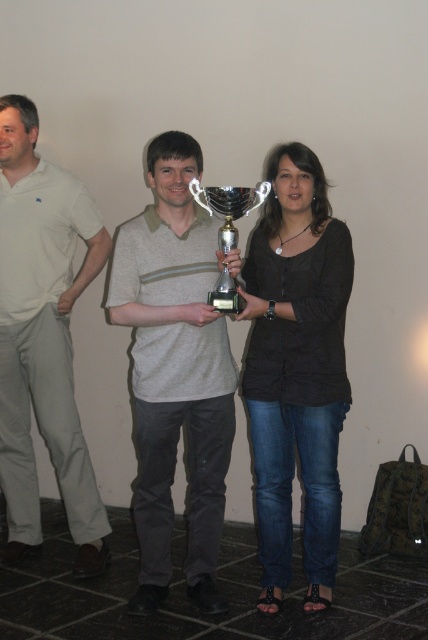
Can you confirm if black matte shirt at center is taller than white cotton shirt at left?

Incorrect, black matte shirt at center's height is not larger of white cotton shirt at left's.

Is point (267, 204) closer to camera compared to point (92, 563)?

Yes, it is.

The height and width of the screenshot is (640, 428). What are the coordinates of `black matte shirt at center` in the screenshot? It's located at (297, 371).

Who is positioned more to the right, gray striped polo shirt at center or white cotton shirt at left?

gray striped polo shirt at center

Looking at this image, is gray striped polo shirt at center bigger than white cotton shirt at left?

Correct, gray striped polo shirt at center is larger in size than white cotton shirt at left.

Does point (222, 440) lie in front of point (24, 408)?

Yes, it is in front of point (24, 408).

The width and height of the screenshot is (428, 640). In order to click on gray striped polo shirt at center in this screenshot , I will do `click(175, 371)`.

Which of these two, white cotton shirt at left or silver metallic trophy at center, stands shorter?

With less height is silver metallic trophy at center.

Image resolution: width=428 pixels, height=640 pixels. What do you see at coordinates (42, 337) in the screenshot? I see `white cotton shirt at left` at bounding box center [42, 337].

Locate an element on the screen. The image size is (428, 640). white cotton shirt at left is located at coordinates (42, 337).